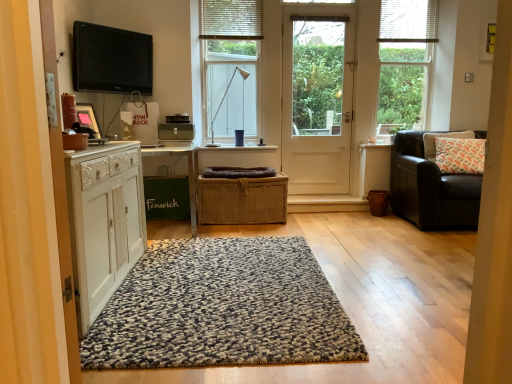
Question: Is leather couch at right far away from green fabric bag at left?

Choices:
 (A) yes
 (B) no

Answer: (A)

Question: Does leather couch at right have a larger size compared to green fabric bag at left?

Choices:
 (A) yes
 (B) no

Answer: (A)

Question: Could you tell me if leather couch at right is facing green fabric bag at left?

Choices:
 (A) yes
 (B) no

Answer: (B)

Question: From a real-world perspective, is leather couch at right located higher than green fabric bag at left?

Choices:
 (A) no
 (B) yes

Answer: (B)

Question: Is the depth of leather couch at right less than that of green fabric bag at left?

Choices:
 (A) no
 (B) yes

Answer: (A)

Question: From the image's perspective, relative to white wooden door at center, is white fabric pillow at right above or below?

Choices:
 (A) above
 (B) below

Answer: (B)

Question: Considering the positions of white fabric pillow at right and white wooden door at center in the image, is white fabric pillow at right taller or shorter than white wooden door at center?

Choices:
 (A) tall
 (B) short

Answer: (B)

Question: Based on their sizes in the image, would you say white fabric pillow at right is bigger or smaller than white wooden door at center?

Choices:
 (A) big
 (B) small

Answer: (B)

Question: Is point (424, 139) positioned closer to the camera than point (285, 127)?

Choices:
 (A) farther
 (B) closer

Answer: (B)

Question: Relative to white textured blind at upper center, which is counted as the 2th blind, starting from the right, is braided brown basket at center in front or behind?

Choices:
 (A) behind
 (B) front

Answer: (B)

Question: Based on their sizes in the image, would you say braided brown basket at center is bigger or smaller than white textured blind at upper center, the 1th blind viewed from the left?

Choices:
 (A) big
 (B) small

Answer: (A)

Question: From the image's perspective, is braided brown basket at center above or below white textured blind at upper center, the 1th blind viewed from the left?

Choices:
 (A) above
 (B) below

Answer: (B)

Question: Is braided brown basket at center wider or thinner than white textured blind at upper center, the 1th blind viewed from the left?

Choices:
 (A) thin
 (B) wide

Answer: (B)

Question: From the image's perspective, is textured wool rug at center above or below braided brown basket at center?

Choices:
 (A) below
 (B) above

Answer: (A)

Question: From a real-world perspective, is textured wool rug at center physically located above or below braided brown basket at center?

Choices:
 (A) below
 (B) above

Answer: (A)